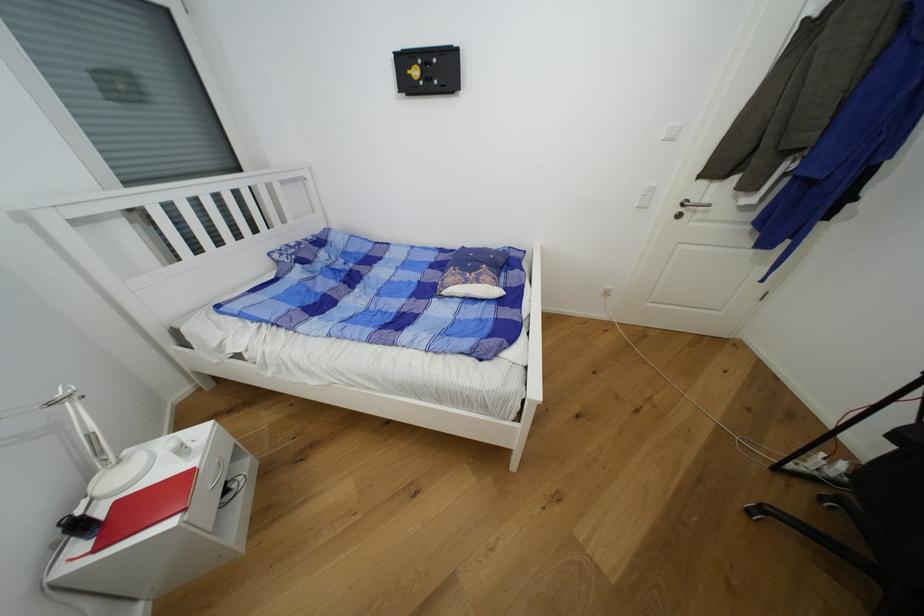
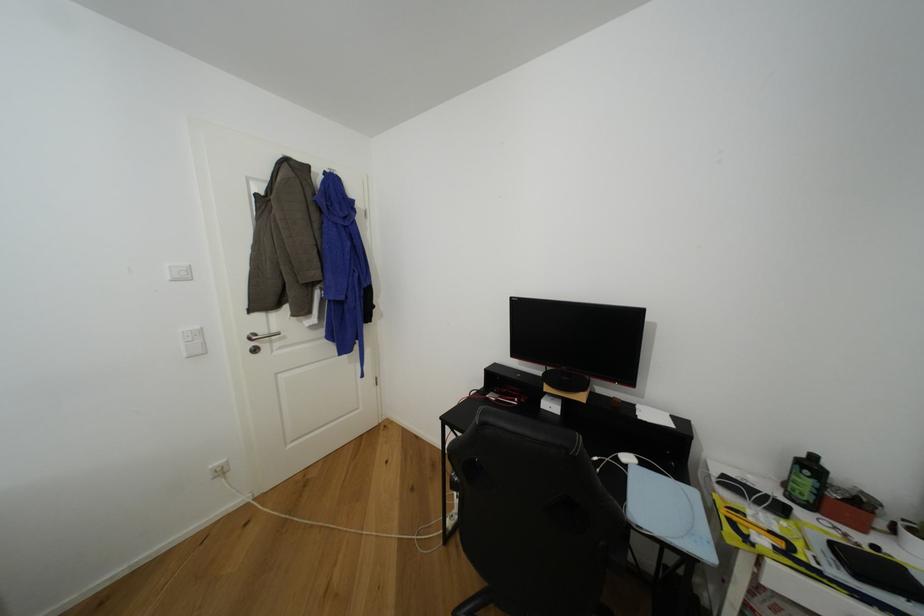
Question: The camera is either moving clockwise (left) or counter-clockwise (right) around the object. The first image is from the beginning of the video and the second image is from the end. Is the camera moving left or right when shooting the video?

Choices:
 (A) Left
 (B) Right

Answer: (A)